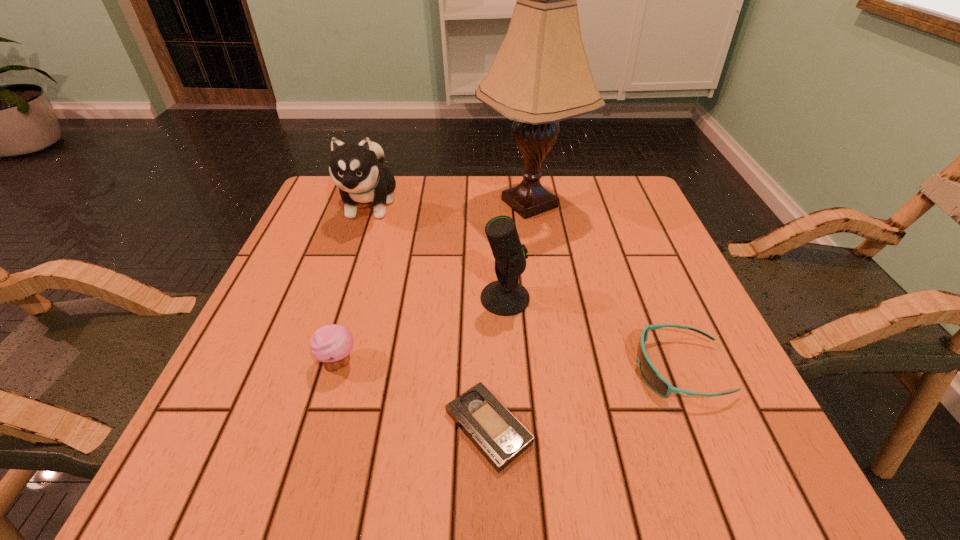
This screenshot has width=960, height=540. Find the location of `sunglasses positioned at the right edge`. sunglasses positioned at the right edge is located at coordinates (650, 374).

The width and height of the screenshot is (960, 540). I want to click on object situated at the far left corner, so pyautogui.click(x=357, y=170).

Identify the location of object at the far right corner. (541, 75).

Find the location of `free space at the near edge of the desktop`. free space at the near edge of the desktop is located at coordinates (514, 460).

This screenshot has width=960, height=540. In the image, there is a desktop. What are the coordinates of `free space at the left edge` in the screenshot? It's located at (256, 379).

Where is `blank area at the right edge`? blank area at the right edge is located at coordinates (690, 362).

The width and height of the screenshot is (960, 540). In the image, there is a desktop. What are the coordinates of `vacant region at the far right corner` in the screenshot? It's located at coord(651,219).

Identify the location of free location at the near right corner. (703, 485).

The image size is (960, 540). I want to click on empty space that is in between the puppy and the cupcake, so click(354, 283).

Where is `vacant point located between the fourth tallest object and the puppy`? The image size is (960, 540). vacant point located between the fourth tallest object and the puppy is located at coordinates (354, 283).